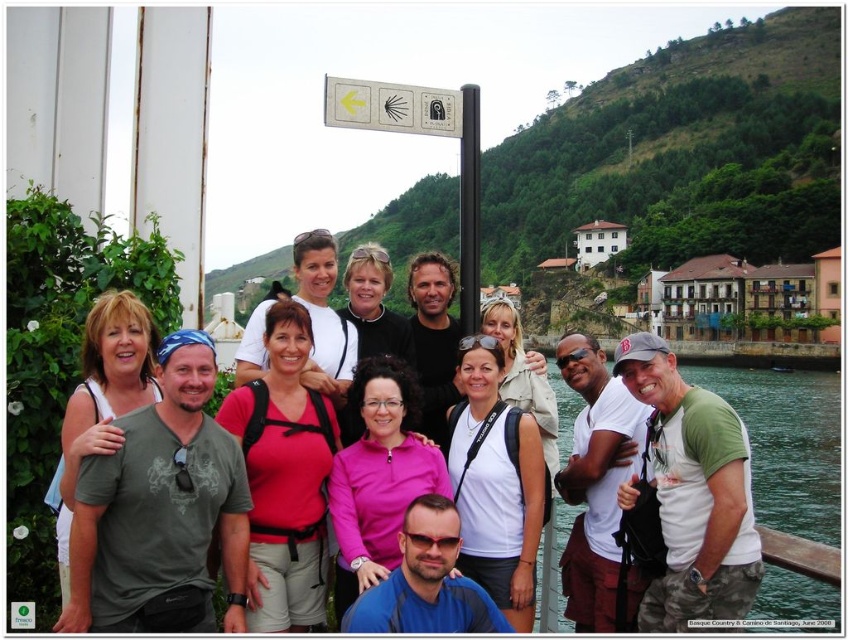
You are a photographer trying to capture a photo of the group while ensuring the white plastic sign at upper center and the black metal pole at center are both visible in the frame. Based on their widths, which object should you focus on to make sure both are in the frame?

The white plastic sign at upper center might be wider than the black metal pole at center, so focusing on the wider object, the white plastic sign at upper center, would help ensure both are visible in the frame.

From the picture: You are standing in the scene and want to find the transparent water at lower right. According to the coordinates provided, where should you look?

The transparent water at lower right is located at point [788,444].